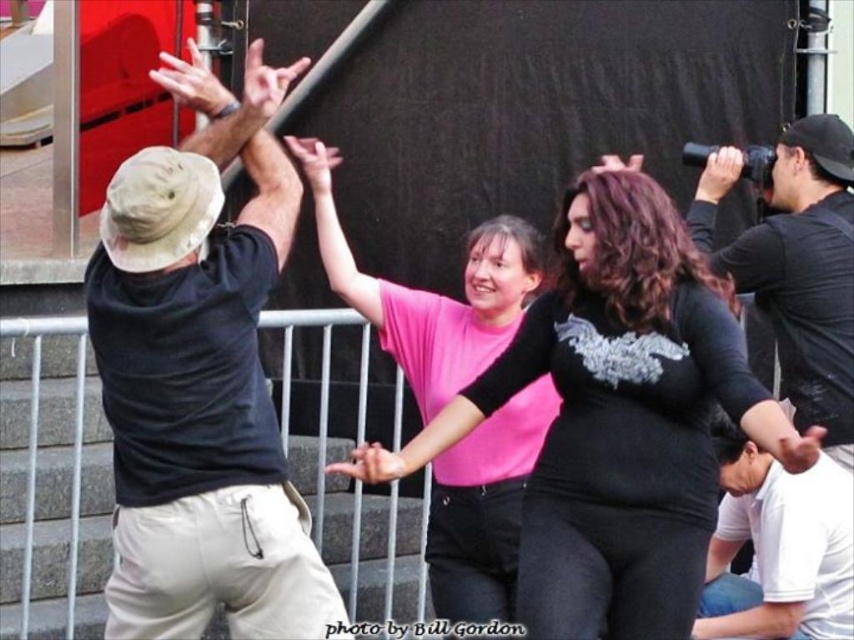
Question: Among these objects, which one is farthest from the camera?

Choices:
 (A) pink matte shirt at center
 (B) metal/textured rail at left
 (C) khaki cotton shorts at left

Answer: (B)

Question: Among these points, which one is farthest from the camera?

Choices:
 (A) (771, 301)
 (B) (189, 548)

Answer: (A)

Question: Does khaki cotton shorts at left appear under matte black shirt at center?

Choices:
 (A) no
 (B) yes

Answer: (A)

Question: Does khaki cotton shorts at left appear over pink matte shirt at center?

Choices:
 (A) yes
 (B) no

Answer: (B)

Question: Does khaki cotton shorts at left appear on the left side of white cotton shirt at lower right?

Choices:
 (A) yes
 (B) no

Answer: (A)

Question: Among these points, which one is farthest from the camera?

Choices:
 (A) (218, 257)
 (B) (779, 464)
 (C) (351, 560)

Answer: (C)